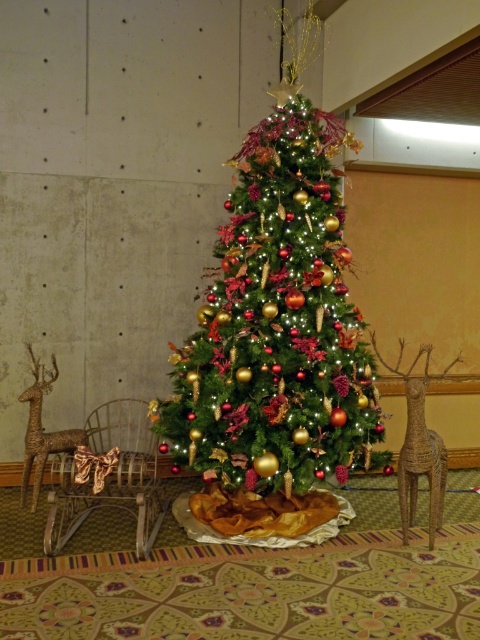
Is shiny gold ornaments at center closer to camera compared to rustic brown deer at left?

No.

Is point (336, 289) positioned before point (36, 460)?

No, it is not.

This screenshot has height=640, width=480. Identify the location of shiny gold ornaments at center. (277, 314).

Where is `shiny gold ornaments at center`? The width and height of the screenshot is (480, 640). shiny gold ornaments at center is located at coordinates (277, 314).

Does shiny gold ornaments at center have a lesser width compared to woven wood reindeer at right?

In fact, shiny gold ornaments at center might be wider than woven wood reindeer at right.

Does point (324, 388) come in front of point (408, 454)?

No, it is behind (408, 454).

At what (x,y) coordinates should I click in order to perform the action: click on shiny gold ornaments at center. Please return your answer as a coordinate pair (x, y). Looking at the image, I should click on (277, 314).

Image resolution: width=480 pixels, height=640 pixels. Describe the element at coordinates (419, 445) in the screenshot. I see `woven wood reindeer at right` at that location.

Which is in front, point (411, 444) or point (84, 435)?

Point (411, 444)

Identify the location of woven wood reindeer at right. (419, 445).